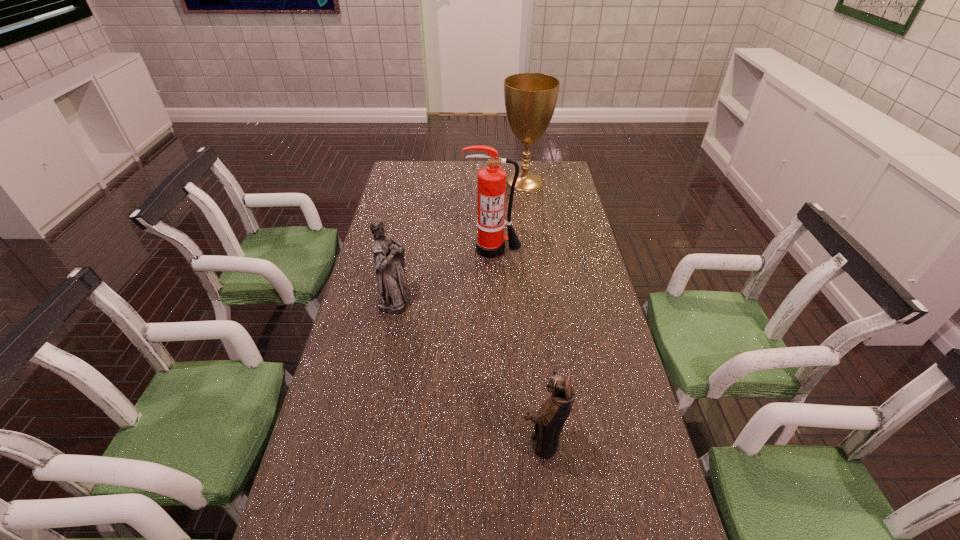
In order to click on trophy cup in this screenshot , I will do 530,98.

Find the location of a particular element. This screenshot has width=960, height=540. the third nearest object is located at coordinates (491, 180).

You are a GUI agent. You are given a task and a screenshot of the screen. Output one action in this format:
    pyautogui.click(x=<x>, y=<y>)
    Task: Click on the third farthest object
    The height and width of the screenshot is (540, 960).
    Given the screenshot: What is the action you would take?
    pyautogui.click(x=393, y=289)

This screenshot has height=540, width=960. What are the coordinates of `the farther figurine` in the screenshot? It's located at (393, 289).

Image resolution: width=960 pixels, height=540 pixels. Identify the location of the nearer figurine. (549, 421).

The image size is (960, 540). In order to click on the right figurine in this screenshot , I will do `click(549, 421)`.

In order to click on vacant space positioned on the back of the trophy cup in this screenshot , I will do `click(522, 164)`.

Locate an element on the screen. Image resolution: width=960 pixels, height=540 pixels. vacant space located at the nozzle of the second farthest object is located at coordinates (493, 281).

Where is `free space located on the front-facing side of the farther figurine`? The image size is (960, 540). free space located on the front-facing side of the farther figurine is located at coordinates [475, 297].

The height and width of the screenshot is (540, 960). I want to click on free space located 0.220m on the front-facing side of the nearer figurine, so click(x=428, y=441).